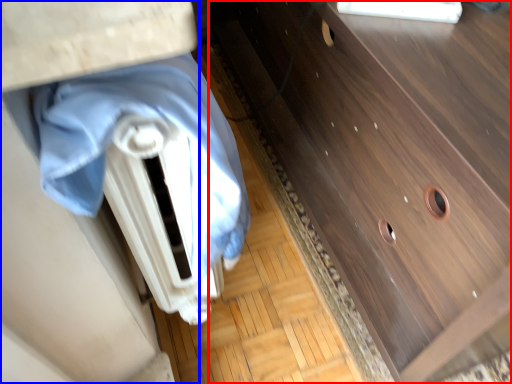
Question: Which object is closer to the camera taking this photo, chest of drawers (highlighted by a red box) or vanity (highlighted by a blue box)?

Choices:
 (A) chest of drawers
 (B) vanity

Answer: (B)